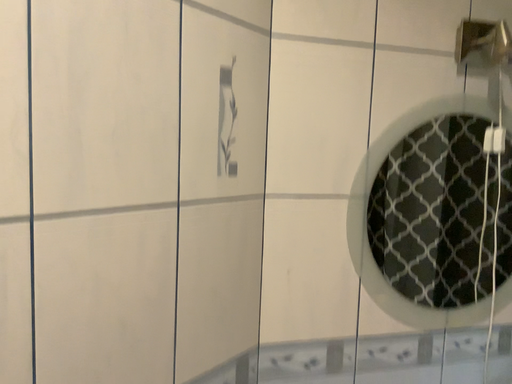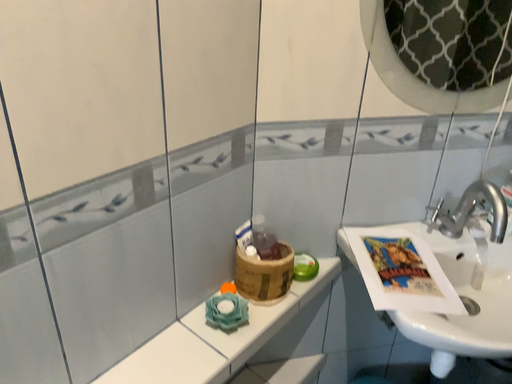
Question: Which way did the camera rotate in the video?

Choices:
 (A) rotated upward
 (B) rotated downward

Answer: (B)